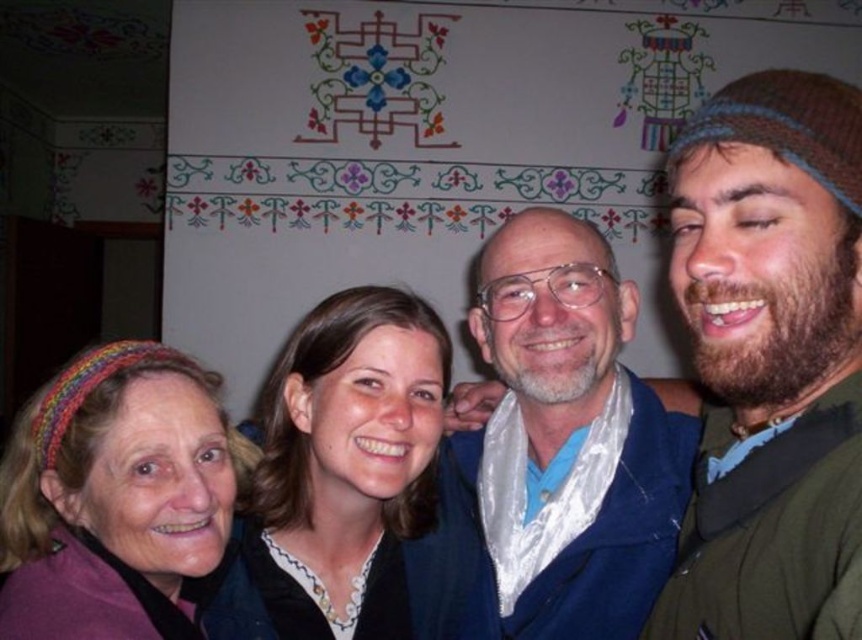
Does blue fabric at center have a lesser height compared to smooth brown hair at center?

No.

Can you confirm if blue fabric at center is positioned below smooth brown hair at center?

Indeed, blue fabric at center is positioned under smooth brown hair at center.

Does point (592, 307) come closer to viewer compared to point (397, 380)?

That is False.

Image resolution: width=862 pixels, height=640 pixels. What are the coordinates of `blue fabric at center` in the screenshot? It's located at (567, 440).

Which is more to the left, blue fabric at center or multicolored knitted headband at left?

multicolored knitted headband at left

Is blue fabric at center further to camera compared to multicolored knitted headband at left?

Yes, it is.

Does point (671, 406) come closer to viewer compared to point (114, 536)?

That is False.

Identify the location of blue fabric at center. The image size is (862, 640). 567,440.

Is point (308, 458) closer to viewer compared to point (48, 627)?

No, it is not.

Where is `smooth brown hair at center`? The image size is (862, 640). smooth brown hair at center is located at coordinates (347, 481).